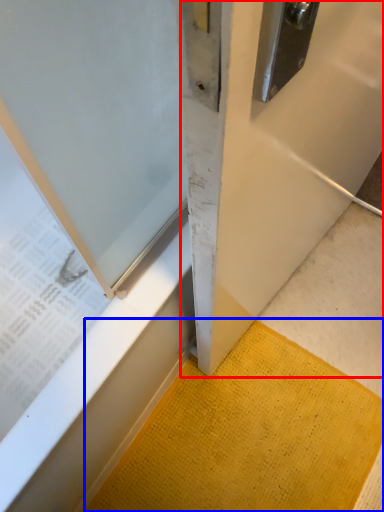
Question: Which point is closer to the camera, door (highlighted by a red box) or doormat (highlighted by a blue box)?

Choices:
 (A) door
 (B) doormat

Answer: (A)